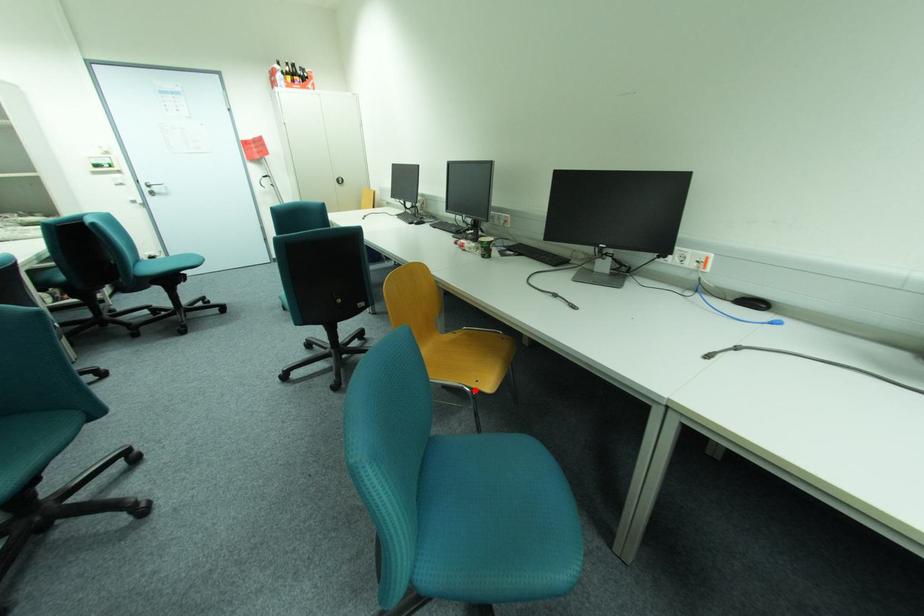
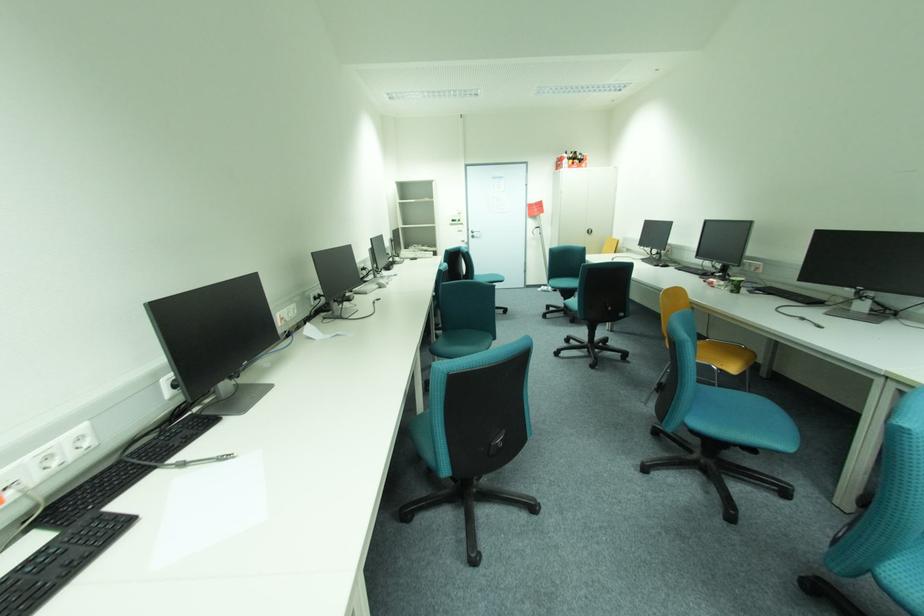
Find the pixel in the second image that matches the highlighted location in the first image.

(722, 369)